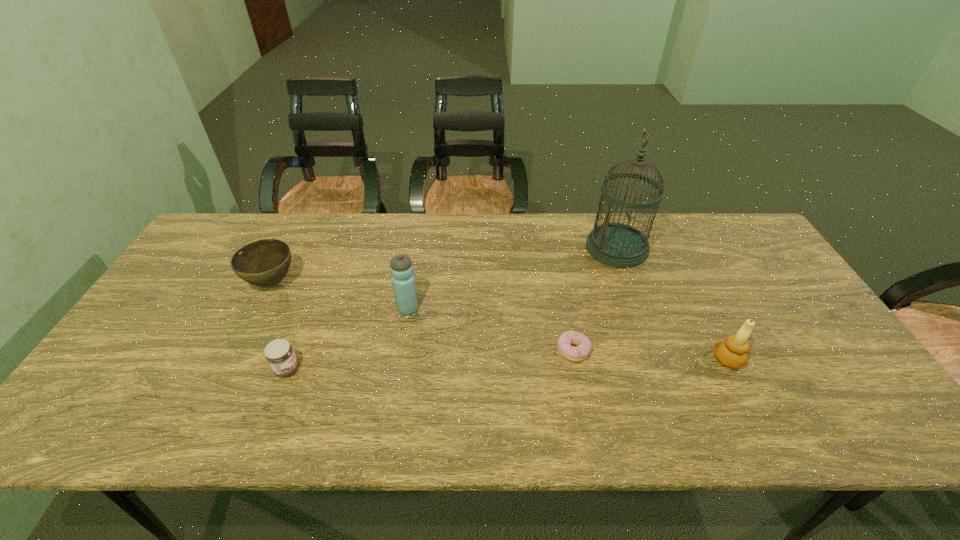
This screenshot has height=540, width=960. I want to click on the tallest object, so click(618, 245).

Image resolution: width=960 pixels, height=540 pixels. In order to click on birdcage in this screenshot , I will do `click(618, 245)`.

Identify the location of the third object from left to right. The width and height of the screenshot is (960, 540). (403, 279).

I want to click on water bottle, so click(x=403, y=279).

Identify the location of the rightmost object. The height and width of the screenshot is (540, 960). (733, 353).

Identify the location of the third tallest object. point(733,353).

Where is `the fourth tallest object`? the fourth tallest object is located at coordinates (264, 263).

Image resolution: width=960 pixels, height=540 pixels. I want to click on the leftmost object, so [x=264, y=263].

This screenshot has height=540, width=960. Find the location of `the fifth object from right to left`. the fifth object from right to left is located at coordinates (279, 353).

Where is `jam`? jam is located at coordinates (279, 353).